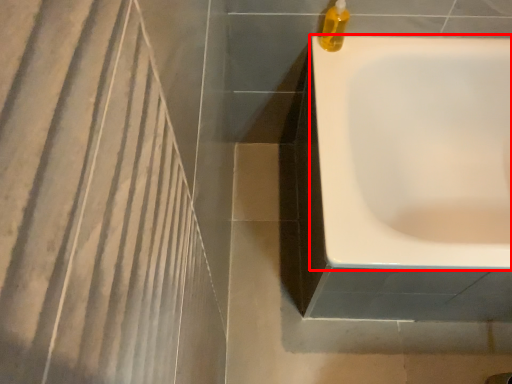
Question: From the image, what is the correct spatial relationship of bathtub (annotated by the red box) in relation to liquid?

Choices:
 (A) right
 (B) left

Answer: (A)